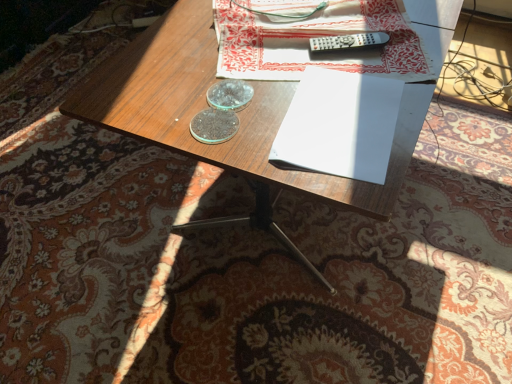
Find the location of a particular element. This screenshot has width=512, height=384. free space between black plastic remote at upper center and white paper at center is located at coordinates (345, 74).